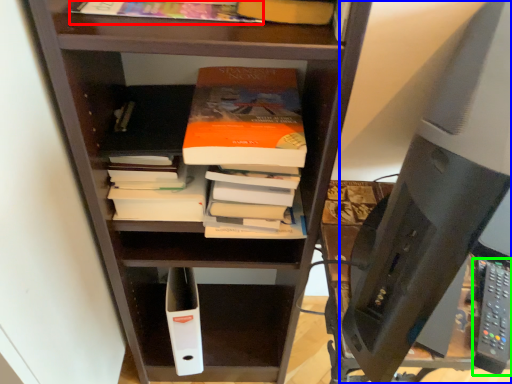
Question: Based on their relative distances, which object is nearer to book (highlighted by a red box)? Choose from desktop computer (highlighted by a blue box) and remote (highlighted by a green box).

Choices:
 (A) desktop computer
 (B) remote

Answer: (A)